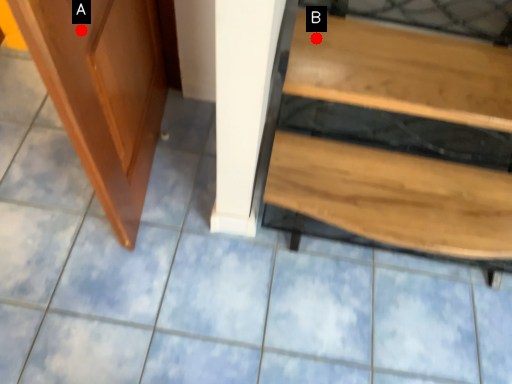
Question: Two points are circled on the image, labeled by A and B beside each circle. Which of the following is the closest to the observer?

Choices:
 (A) A is closer
 (B) B is closer

Answer: (A)